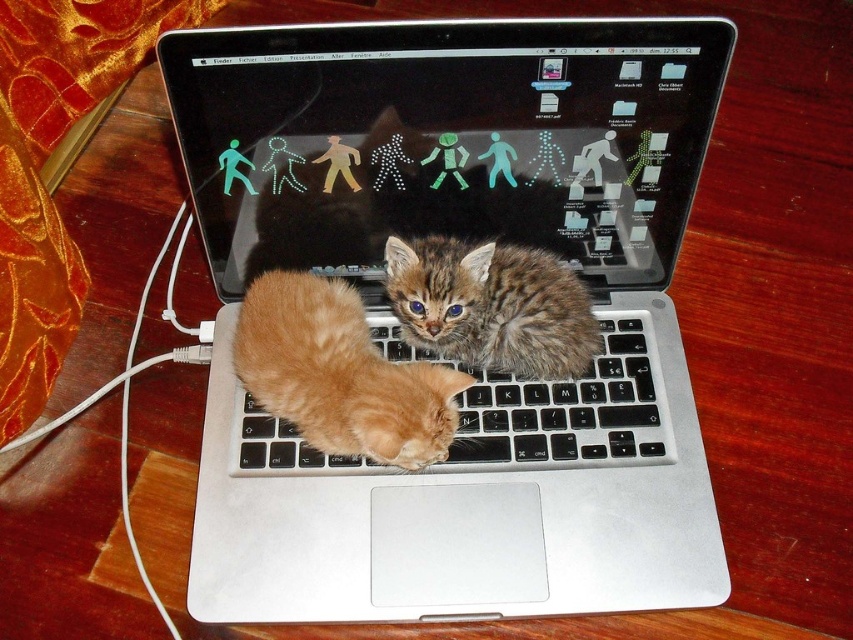
Question: Is black plastic keyboard at center closer to the viewer compared to tabby fur at center?

Choices:
 (A) yes
 (B) no

Answer: (B)

Question: Is silver metallic laptop at center positioned before black plastic keyboard at center?

Choices:
 (A) yes
 (B) no

Answer: (A)

Question: Among these points, which one is farthest from the camera?

Choices:
 (A) (635, 339)
 (B) (415, 244)

Answer: (A)

Question: Based on their relative distances, which object is nearer to the silver metallic laptop at center?

Choices:
 (A) tabby fur at center
 (B) black plastic keyboard at center

Answer: (B)

Question: Is the position of black plastic keyboard at center less distant than that of tabby fur at center?

Choices:
 (A) no
 (B) yes

Answer: (A)

Question: Which point appears closest to the camera in this image?

Choices:
 (A) (569, 320)
 (B) (334, 296)
 (C) (495, 413)

Answer: (B)